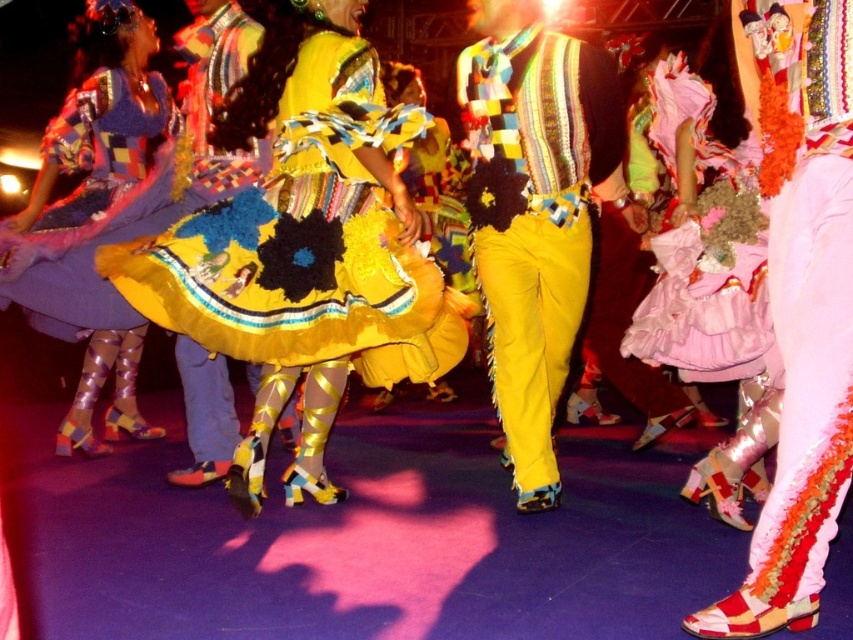
You are a photographer at the dance performance. You want to capture a photo of the dancer wearing the yellow textured fabric dress at center and yellow textured pants at center. Which part of the costume should be in focus to ensure the dress is visible above the pants?

The yellow textured fabric dress at center is located above the yellow textured pants at center, so focusing on the upper part of the costume will ensure the dress is visible above the pants.

What are the coordinates of the yellow textured fabric dress at center in the image?

The yellow textured fabric dress at center is located at coordinates point (306, 243).